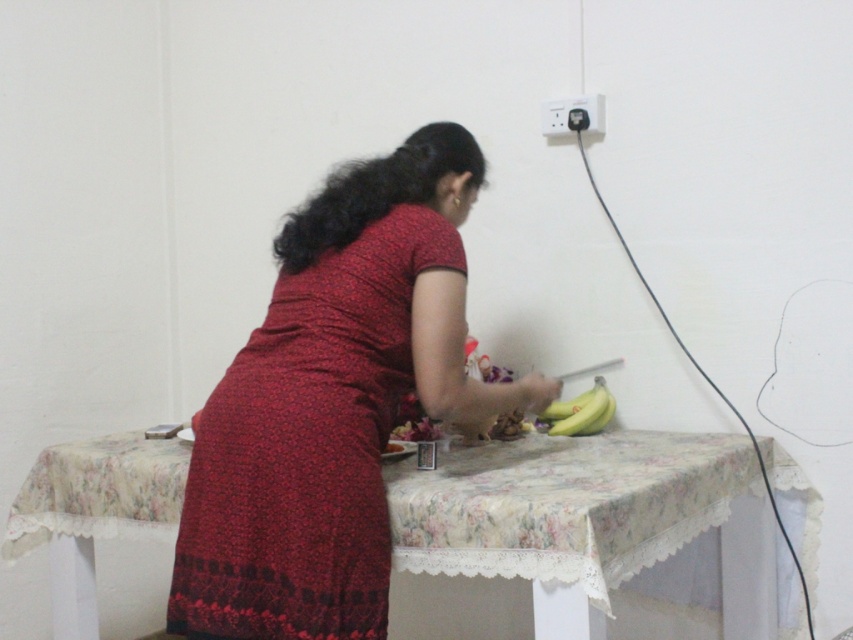
You are standing in front of the table and want to place a new vase exactly where the matte red dress at center is currently located. Is this possible?

The position of matte red dress at center is at point (x=334, y=403), so yes, you can place the vase there as long as the coordinates are accessible on the table.

You are a photographer setting up a shoot. You need to ensure that the matte red dress at center is visible without being obscured by the floral fabric table at center. Based on the scene description, is the dress positioned in a way that allows it to be seen clearly?

The matte red dress at center is above the floral fabric table at center, so it is positioned in a way that allows it to be seen clearly without obstruction.